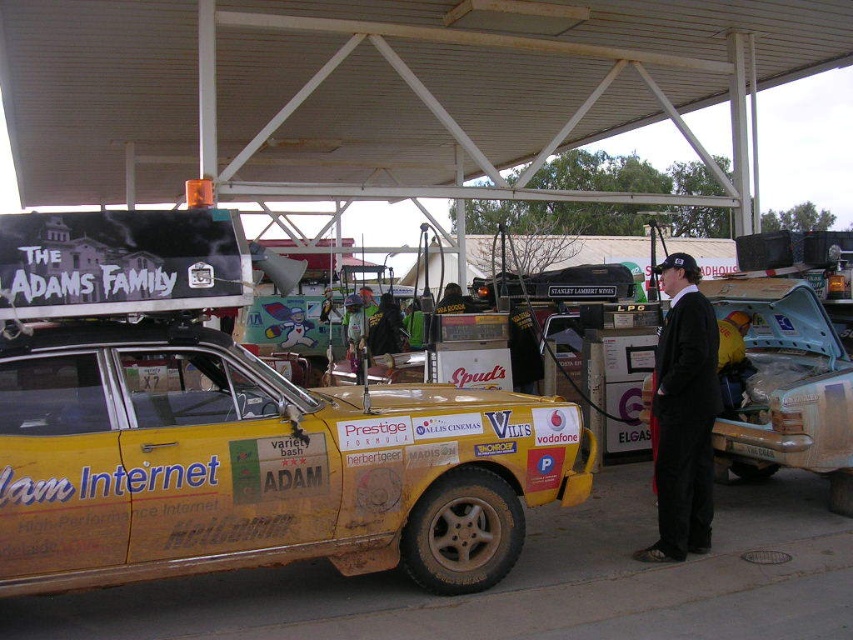
You are standing at the gas station under the large white canopy. You see a rusty metal car at center and a black suit at center. Which object is positioned to the right of the other?

The rusty metal car at center is to the right of the black suit at center.

You are standing at the gas station under the canopy and want to walk from point A to point B. Point A is at coordinates point (792, 301) and point B is at coordinates point (689, 259). Which direction should you walk to reach point B from point A?

Since point (792, 301) is behind point (689, 259), you should walk forward to reach point B from point A.